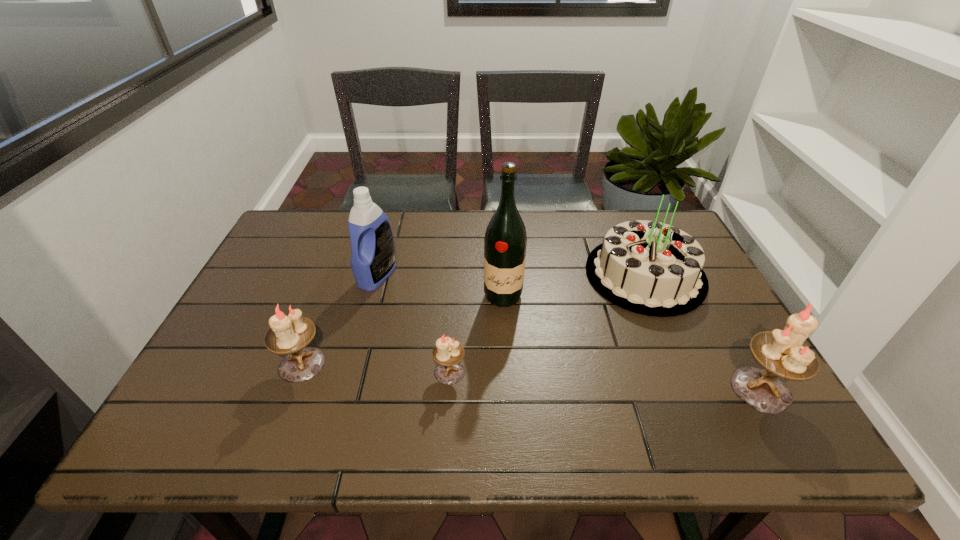
The width and height of the screenshot is (960, 540). I want to click on free area in between the third object from left to right and the birthday cake, so click(x=547, y=323).

The height and width of the screenshot is (540, 960). What are the coordinates of `empty space between the second tallest candle holder and the detergent` in the screenshot? It's located at (340, 320).

You are a GUI agent. You are given a task and a screenshot of the screen. Output one action in this format:
    pyautogui.click(x=<x>, y=<y>)
    Task: Click on the vacant area between the liquor and the birthday cake
    The height and width of the screenshot is (540, 960).
    Given the screenshot: What is the action you would take?
    pyautogui.click(x=574, y=286)

Find the location of a particular element. This screenshot has width=960, height=540. free point between the shortest object and the birthday cake is located at coordinates (547, 323).

You are a GUI agent. You are given a task and a screenshot of the screen. Output one action in this format:
    pyautogui.click(x=<x>, y=<y>)
    Task: Click on the free space that is in between the rightmost candle holder and the fourth object from left to right
    
    Given the screenshot: What is the action you would take?
    pyautogui.click(x=632, y=342)

Identify the location of the second closest object to the rightmost candle holder. (505, 241).

This screenshot has height=540, width=960. I want to click on object identified as the fourth closest to the detergent, so click(x=650, y=268).

What are the coordinates of `the second closest candle holder to the birthday cake` in the screenshot? It's located at (447, 353).

Identify which candle holder is the second nearest to the rightmost candle holder. Please provide its 2D coordinates. Your answer should be formatted as a tuple, i.e. [(x, y)], where the tuple contains the x and y coordinates of a point satisfying the conditions above.

[(289, 335)]

At what (x,y) coordinates should I click in order to perform the action: click on vacant space that satisfies the following two spatial constraints: 1. on the front side of the shortest object; 2. on the right side of the rightmost candle holder. Please return your answer as a coordinate pair (x, y). Image resolution: width=960 pixels, height=540 pixels. Looking at the image, I should click on (448, 389).